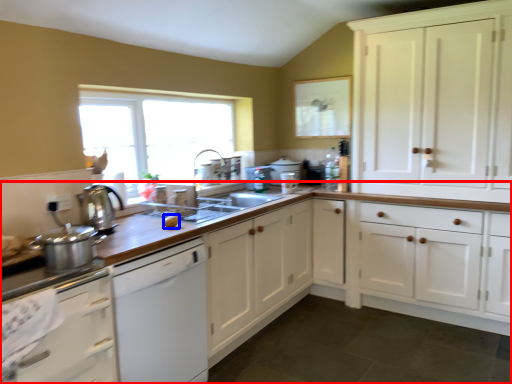
Question: Which of the following is the closest to the observer, countertop (highlighted by a red box) or food (highlighted by a blue box)?

Choices:
 (A) countertop
 (B) food

Answer: (A)